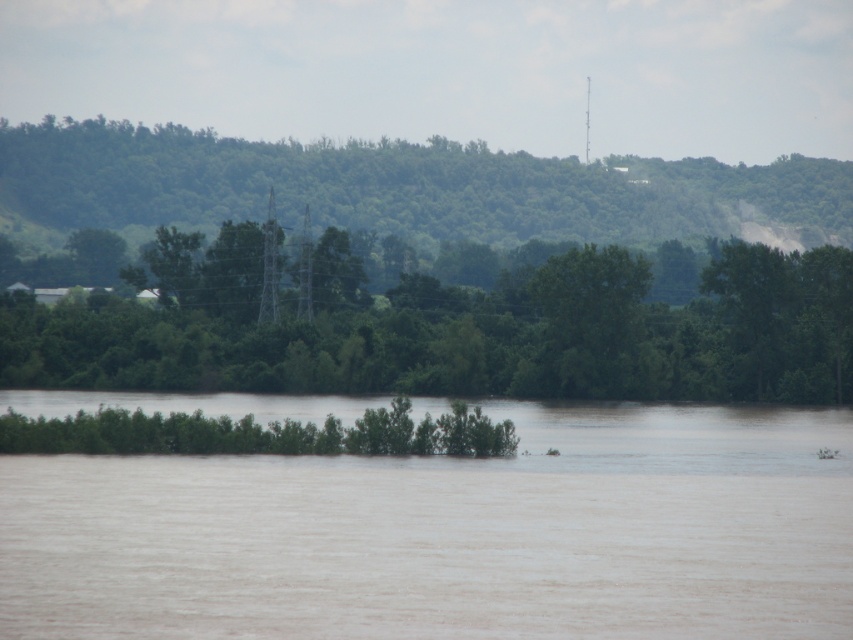
You are standing at the edge of the flooded area and see the brown muddy water at center and the green leafy tree at center. Which object is closer to you?

The brown muddy water at center is closer to the viewer than the green leafy tree at center.

You are standing at the point with coordinates point (260,372) and want to walk towards the point with coordinates point (459,541). Which direction should you move to reach your destination?

You should move forward because point (459,541) is in front of point (260,372).